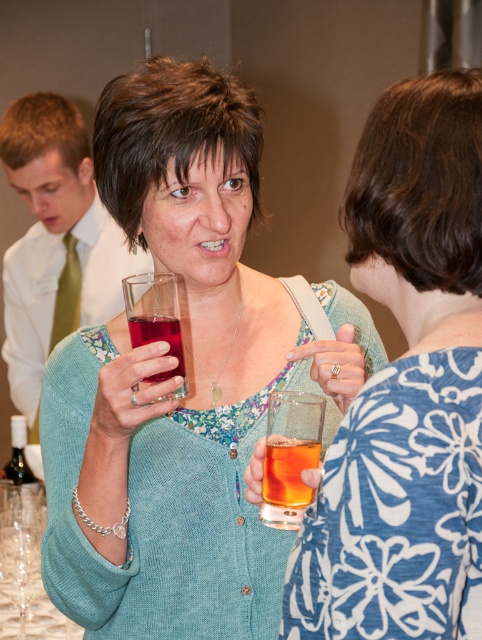
You are at a party and want to pour a drink into the taller glass. Which glass should you choose between the matte glass at center and the translucent glass at upper center?

The matte glass at center is taller than the translucent glass at upper center, so you should choose the matte glass at center to pour your drink into.

You are at a social gathering and want to grab a drink. There is a matte glass at center located at point (181, 380). Can you describe the location of the matte glass at center relative to the two women in the scene?

The matte glass at center is located at point (181, 380), which is between the two women in the scene.

You are at a party and want to grab a drink. You see a matte glass at center and a translucent glass at lower left. Which glass is on the right side when looking at both?

The matte glass at center is positioned on the right side of the translucent glass at lower left.